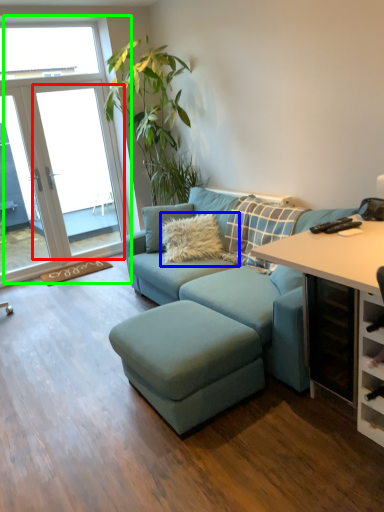
Question: Estimate the real-world distances between objects in this image. Which object is closer to window screen (highlighted by a red box), pillow (highlighted by a blue box) or window (highlighted by a green box)?

Choices:
 (A) pillow
 (B) window

Answer: (B)